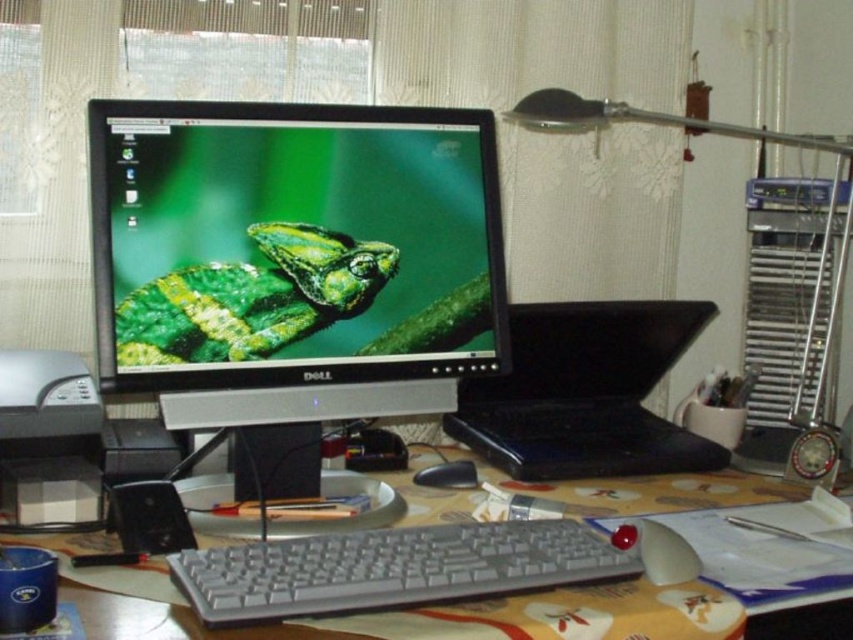
From the picture: You are setting up a new monitor and want to ensure it fits on your existing desk. Based on the image, does the matte black monitor at center have enough height to be placed on the matte plastic computer desk at center without any issues?

The matte black monitor at center has a greater height compared to the matte plastic computer desk at center, so it may not fit properly as the desk is shorter than the monitor.